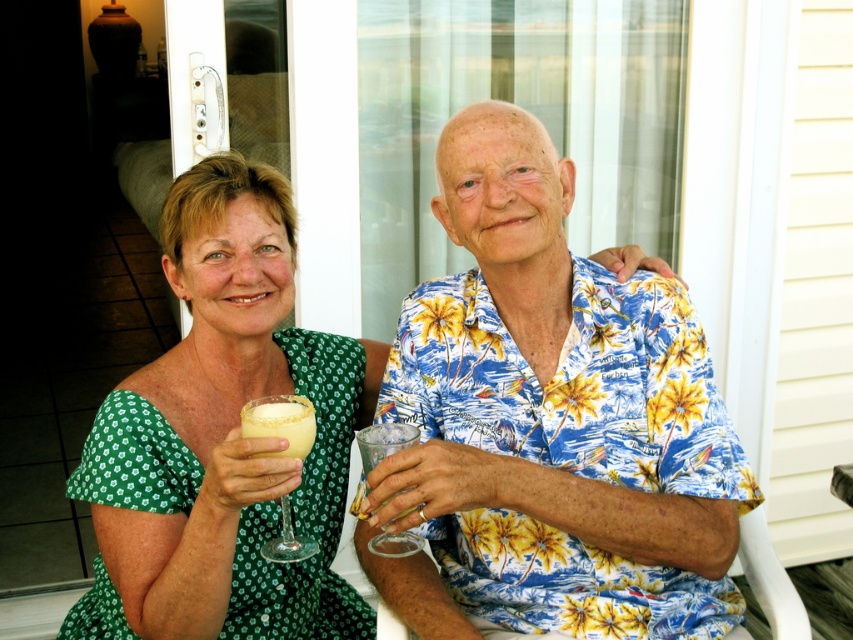
The width and height of the screenshot is (853, 640). In order to click on green floral dress at center in this screenshot , I will do `click(223, 438)`.

Can you confirm if green floral dress at center is wider than transparent glass at right?

Yes, green floral dress at center is wider than transparent glass at right.

Is point (341, 480) in front of point (410, 547)?

No, (341, 480) is behind (410, 547).

Identify the location of green floral dress at center. (223, 438).

Is point (558, 198) positioned after point (360, 605)?

No, (558, 198) is closer to viewer.

Which is above, blue floral shirt at center or green floral dress at center?

blue floral shirt at center

Is point (619, 513) farther from camera compared to point (318, 461)?

No, (619, 513) is closer to viewer.

Identify the location of blue floral shirt at center. pos(550,422).

Is green floral dress at center thinner than clear glass wine glass at center?

In fact, green floral dress at center might be wider than clear glass wine glass at center.

Is point (225, 467) positioned after point (268, 410)?

That is False.

Who is more distant from viewer, [238,310] or [312,412]?

Point [238,310]

Identify the location of green floral dress at center. This screenshot has width=853, height=640. (223, 438).